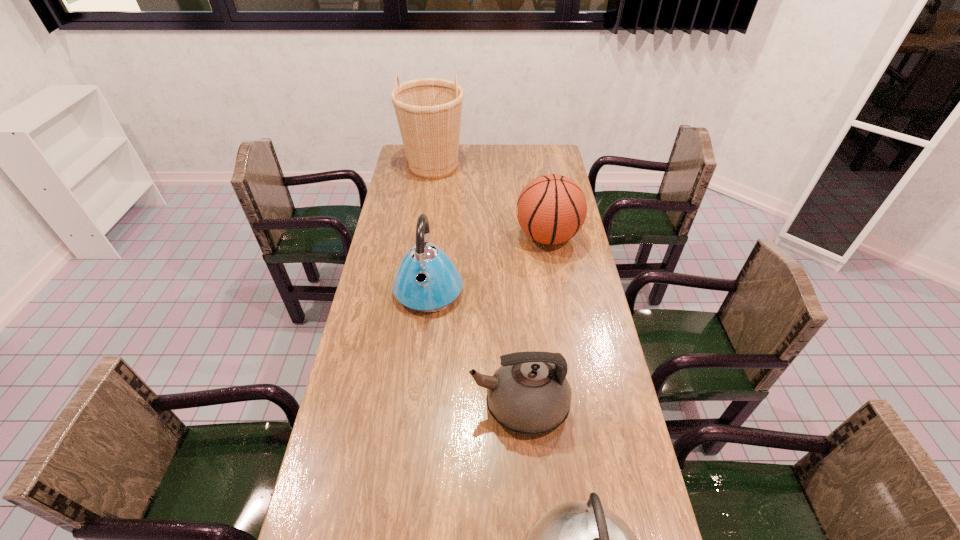
Locate an element on the screen. The image size is (960, 540). blank space at the far edge is located at coordinates (480, 166).

The image size is (960, 540). I want to click on vacant space at the left edge of the desktop, so click(x=371, y=342).

In the image, there is a desktop. Identify the location of free space at the right edge. (585, 401).

Find the location of a particular element. Image resolution: width=960 pixels, height=540 pixels. free space at the far left corner of the desktop is located at coordinates (406, 168).

Locate an element on the screen. empty space that is in between the tallest object and the second nearest object is located at coordinates (476, 286).

The image size is (960, 540). I want to click on empty space that is in between the fourth farthest object and the farthest object, so click(476, 286).

Locate an element on the screen. The image size is (960, 540). unoccupied position between the third nearest object and the second farthest kettle is located at coordinates (474, 347).

Find the location of a particular element. vacant region between the second nearest kettle and the basket is located at coordinates (476, 286).

The height and width of the screenshot is (540, 960). Identify the location of free space that is in between the second nearest object and the basket. (476, 286).

The height and width of the screenshot is (540, 960). What are the coordinates of `free spot between the basket and the second nearest kettle` in the screenshot? It's located at (476, 286).